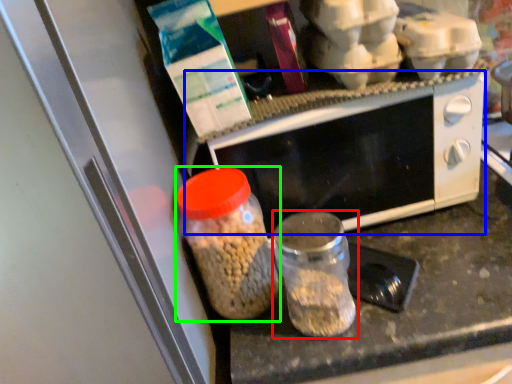
Question: Which is farther away from bottle (highlighted by a red box)? microwave oven (highlighted by a blue box) or bottle (highlighted by a green box)?

Choices:
 (A) microwave oven
 (B) bottle

Answer: (A)